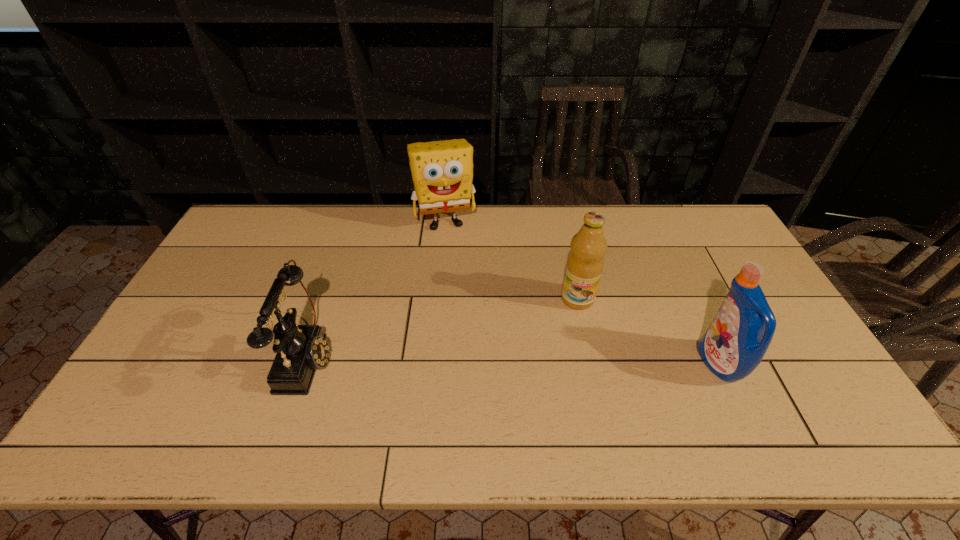
The width and height of the screenshot is (960, 540). What are the coordinates of `free space on the desktop that is between the shortest object and the detergent and is positioned on the label of the third nearest object` in the screenshot? It's located at (566, 361).

In order to click on vacant spot on the desktop that is between the telephone and the rightmost object and is positioned on the face of the sponge in this screenshot , I will do `click(482, 360)`.